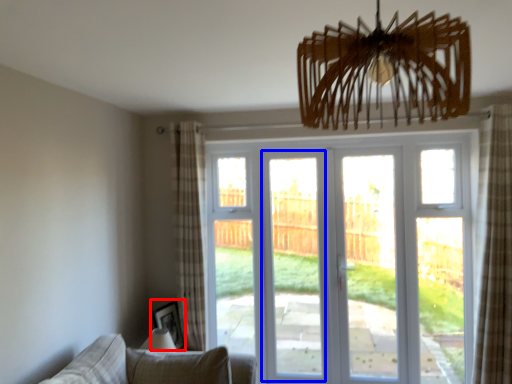
Question: Which object is further to the camera taking this photo, picture frame (highlighted by a red box) or screen door (highlighted by a blue box)?

Choices:
 (A) picture frame
 (B) screen door

Answer: (B)